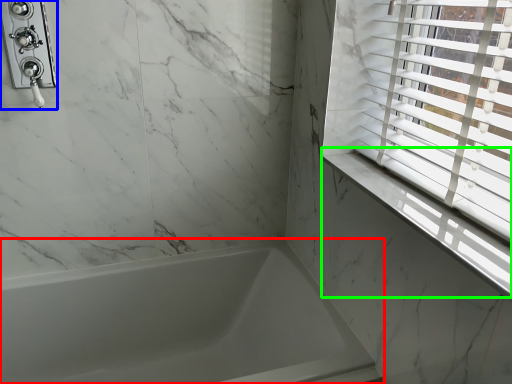
Question: Which object is positioned closest to bathtub (highlighted by a red box)? Select from shower (highlighted by a blue box) and window sill (highlighted by a green box).

Choices:
 (A) shower
 (B) window sill

Answer: (B)